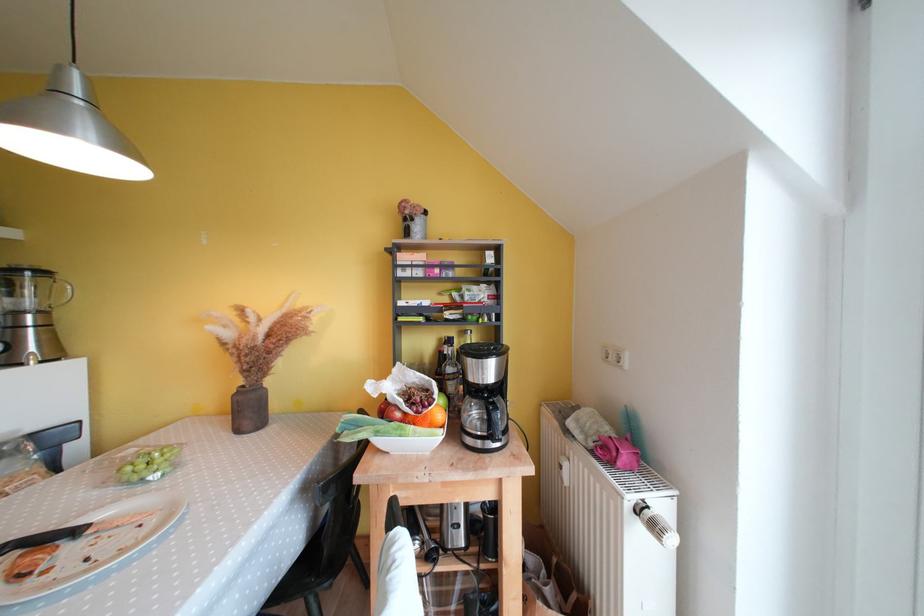
You are a GUI agent. You are given a task and a screenshot of the screen. Output one action in this format:
    pyautogui.click(x=<x>, y=<y>)
    Task: Click on the coffee pot handle
    Image resolution: width=924 pixels, height=616 pixels.
    Given the screenshot: What is the action you would take?
    pyautogui.click(x=30, y=314)